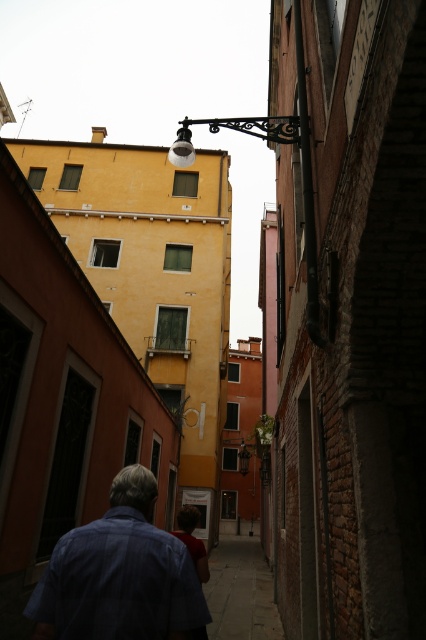
You are a delivery person carrying a package and need to walk along the paved stone sidewalk at center. There is a blue cotton shirt at lower left in your path. Can you walk around it without stepping on the shirt?

The blue cotton shirt at lower left is shorter than the paved stone sidewalk at center, so you can walk around it without stepping on the shirt since it does not obstruct the path heightwise.

From the picture: You are a delivery person carrying a package and need to walk along the paved stone sidewalk at center. To avoid stepping on the blue cotton shirt at lower left, should you walk to the left or right side of the sidewalk?

The blue cotton shirt at lower left is to the left of the paved stone sidewalk at center, so to avoid stepping on it, you should walk to the right side of the sidewalk.

You are a delivery person carrying a large package and need to walk through the alleyway. You see the blue cotton shirt at lower left and the paved stone sidewalk at center. Which path should you choose to ensure there is enough space for your package?

The paved stone sidewalk at center is larger in size than the blue cotton shirt at lower left, so you should choose the paved stone sidewalk at center to ensure there is enough space for your package.